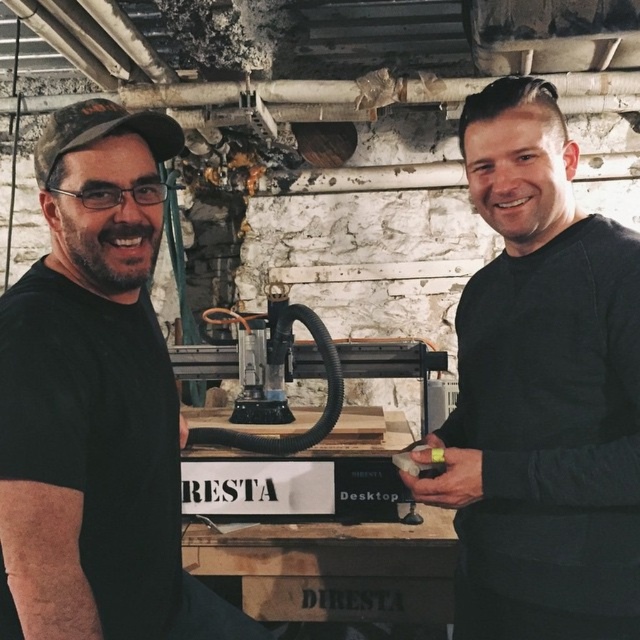
Is black matte shirt at center thinner than black matte t-shirt at left?

No, black matte shirt at center is not thinner than black matte t-shirt at left.

Find the location of `black matte shirt at center`. black matte shirt at center is located at coordinates (541, 392).

Locate an element on the screen. This screenshot has width=640, height=640. black matte shirt at center is located at coordinates (541, 392).